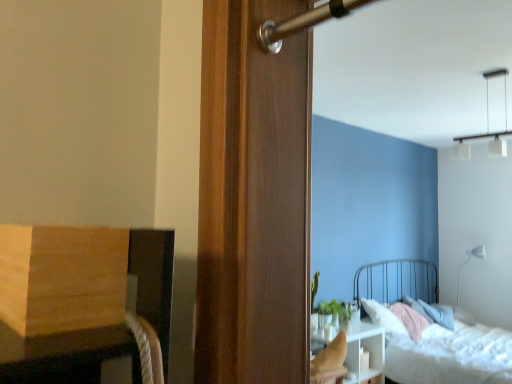
Question: Considering the relative sizes of white matte floor lamp at upper right, the 2th light fixture positioned from the front, and green matte plant at center in the image provided, is white matte floor lamp at upper right, the 2th light fixture positioned from the front, wider than green matte plant at center?

Choices:
 (A) yes
 (B) no

Answer: (B)

Question: Is the depth of white matte floor lamp at upper right, arranged as the 2th light fixture when viewed from the top, greater than that of green matte plant at center?

Choices:
 (A) yes
 (B) no

Answer: (A)

Question: Is white matte floor lamp at upper right, the 2th light fixture positioned from the front, next to green matte plant at center?

Choices:
 (A) no
 (B) yes

Answer: (A)

Question: From a real-world perspective, does white matte floor lamp at upper right, arranged as the 2th light fixture when viewed from the top, stand above green matte plant at center?

Choices:
 (A) yes
 (B) no

Answer: (A)

Question: From the image's perspective, would you say white matte floor lamp at upper right, the 1th light fixture when ordered from right to left, is positioned over green matte plant at center?

Choices:
 (A) yes
 (B) no

Answer: (B)

Question: Is white textured bed at lower right inside or outside of white matte floor lamp at upper right, which is counted as the 2th light fixture, starting from the left?

Choices:
 (A) outside
 (B) inside

Answer: (A)

Question: Is white textured bed at lower right in front of or behind white matte floor lamp at upper right, the first light fixture when ordered from back to front, in the image?

Choices:
 (A) front
 (B) behind

Answer: (A)

Question: Is white textured bed at lower right to the left or to the right of white matte floor lamp at upper right, which is counted as the 2th light fixture, starting from the left, in the image?

Choices:
 (A) left
 (B) right

Answer: (A)

Question: From the image's perspective, is white textured bed at lower right located above or below white matte floor lamp at upper right, the first light fixture when ordered from bottom to top?

Choices:
 (A) above
 (B) below

Answer: (B)

Question: Considering the positions of white matte floor lamp at upper right, the first light fixture when ordered from bottom to top, and white textured bed at lower right in the image, is white matte floor lamp at upper right, the first light fixture when ordered from bottom to top, taller or shorter than white textured bed at lower right?

Choices:
 (A) tall
 (B) short

Answer: (B)

Question: Visually, is white matte floor lamp at upper right, which is counted as the 2th light fixture, starting from the left, positioned to the left or to the right of white textured bed at lower right?

Choices:
 (A) right
 (B) left

Answer: (A)

Question: Relative to white textured bed at lower right, is white matte floor lamp at upper right, which is counted as the 2th light fixture, starting from the left, in front or behind?

Choices:
 (A) front
 (B) behind

Answer: (B)

Question: Considering the positions of white matte floor lamp at upper right, which is counted as the 2th light fixture, starting from the left, and white textured bed at lower right in the image, is white matte floor lamp at upper right, which is counted as the 2th light fixture, starting from the left, wider or thinner than white textured bed at lower right?

Choices:
 (A) wide
 (B) thin

Answer: (B)

Question: Based on their sizes in the image, would you say white matte floor lamp at upper right, the 1th light fixture when ordered from right to left, is bigger or smaller than white glass pendant lights at upper right, placed as the first light fixture when sorted from left to right?

Choices:
 (A) big
 (B) small

Answer: (A)

Question: Does point (458, 291) appear closer or farther from the camera than point (470, 155)?

Choices:
 (A) closer
 (B) farther

Answer: (B)